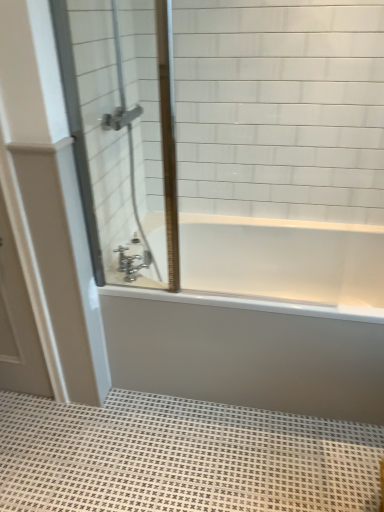
Question: Would you consider chrome metallic faucet at center to be distant from white glossy bathtub at center?

Choices:
 (A) no
 (B) yes

Answer: (A)

Question: Is chrome metallic faucet at center aimed at white glossy bathtub at center?

Choices:
 (A) yes
 (B) no

Answer: (A)

Question: Can you confirm if chrome metallic faucet at center is taller than white glossy bathtub at center?

Choices:
 (A) yes
 (B) no

Answer: (B)

Question: Does chrome metallic faucet at center have a lesser width compared to white glossy bathtub at center?

Choices:
 (A) no
 (B) yes

Answer: (B)

Question: Is white glossy bathtub at center at the back of chrome metallic faucet at center?

Choices:
 (A) yes
 (B) no

Answer: (B)

Question: From the image's perspective, relative to clear glass shower door at left, is chrome metallic faucet at center above or below?

Choices:
 (A) below
 (B) above

Answer: (A)

Question: Is chrome metallic faucet at center wider or thinner than clear glass shower door at left?

Choices:
 (A) wide
 (B) thin

Answer: (B)

Question: Based on their positions, is chrome metallic faucet at center located to the left or right of clear glass shower door at left?

Choices:
 (A) right
 (B) left

Answer: (B)

Question: Is point (145, 256) positioned closer to the camera than point (147, 13)?

Choices:
 (A) closer
 (B) farther

Answer: (B)

Question: From a real-world perspective, relative to white glossy bathtub at center, is white textured bath mat at lower center vertically above or below?

Choices:
 (A) above
 (B) below

Answer: (B)

Question: Choose the correct answer: Is white textured bath mat at lower center inside white glossy bathtub at center or outside it?

Choices:
 (A) inside
 (B) outside

Answer: (B)

Question: Does point (220, 484) appear closer or farther from the camera than point (152, 338)?

Choices:
 (A) closer
 (B) farther

Answer: (A)

Question: Looking at their shapes, would you say white textured bath mat at lower center is wider or thinner than white glossy bathtub at center?

Choices:
 (A) wide
 (B) thin

Answer: (A)

Question: Choose the correct answer: Is clear glass shower door at left inside white textured bath mat at lower center or outside it?

Choices:
 (A) outside
 (B) inside

Answer: (A)

Question: Is clear glass shower door at left in front of or behind white textured bath mat at lower center in the image?

Choices:
 (A) front
 (B) behind

Answer: (A)